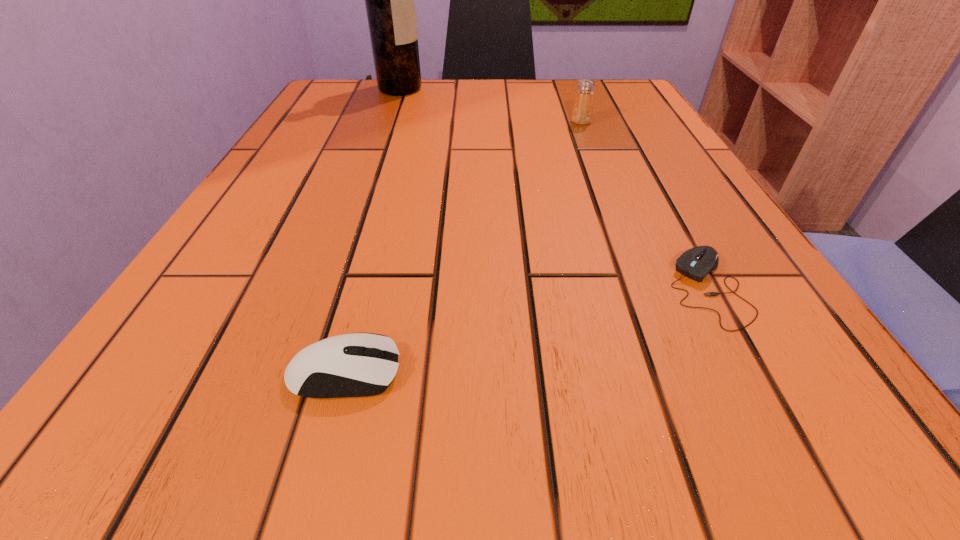
You are a GUI agent. You are given a task and a screenshot of the screen. Output one action in this format:
    pyautogui.click(x=<x>, y=<y>)
    Task: Click on the vacant space located on the right of the third tallest object
    Image resolution: width=960 pixels, height=540 pixels.
    Given the screenshot: What is the action you would take?
    pyautogui.click(x=571, y=373)

At what (x,y) coordinates should I click in order to perform the action: click on free space located on the back of the third farthest object. Please return your answer as a coordinate pair (x, y). The image size is (960, 540). Looking at the image, I should click on pos(662,204).

Find the location of a particular element. This screenshot has width=960, height=540. liquor positioned at the far edge is located at coordinates (389, 0).

Find the location of a particular element. The width and height of the screenshot is (960, 540). saltshaker that is positioned at the far edge is located at coordinates (582, 111).

Identify the location of object that is positioned at the near edge. The height and width of the screenshot is (540, 960). (350, 365).

Locate an element on the screen. The image size is (960, 540). object positioned at the left edge is located at coordinates (389, 0).

Identify the location of saltshaker that is at the right edge. The width and height of the screenshot is (960, 540). (582, 111).

This screenshot has width=960, height=540. Identify the location of computer mouse that is positioned at the right edge. (696, 263).

You are a GUI agent. You are given a task and a screenshot of the screen. Output one action in this format:
    pyautogui.click(x=<x>, y=<y>)
    Task: Click on the object located in the far left corner section of the desktop
    The height and width of the screenshot is (540, 960).
    Given the screenshot: What is the action you would take?
    pyautogui.click(x=389, y=0)

The width and height of the screenshot is (960, 540). I want to click on object present at the far right corner, so click(582, 111).